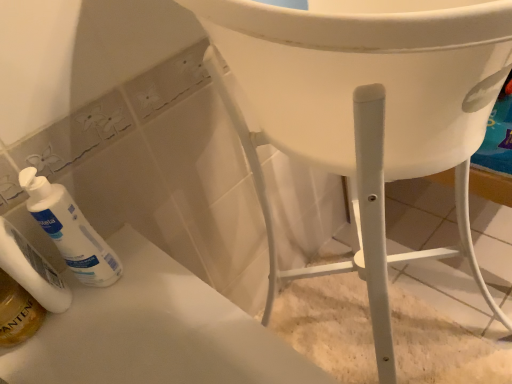
Question: Is translucent golden mouthwash at lower left aimed at white matte lotion at lower left?

Choices:
 (A) yes
 (B) no

Answer: (B)

Question: Does translucent golden mouthwash at lower left appear on the left side of white matte lotion at lower left?

Choices:
 (A) yes
 (B) no

Answer: (A)

Question: From a real-world perspective, is translucent golden mouthwash at lower left beneath white matte lotion at lower left?

Choices:
 (A) yes
 (B) no

Answer: (A)

Question: Is translucent golden mouthwash at lower left taller than white matte lotion at lower left?

Choices:
 (A) yes
 (B) no

Answer: (B)

Question: Is translucent golden mouthwash at lower left closer to the viewer compared to white matte lotion at lower left?

Choices:
 (A) yes
 (B) no

Answer: (B)

Question: Is translucent golden mouthwash at lower left behind white matte lotion at lower left?

Choices:
 (A) yes
 (B) no

Answer: (A)

Question: Would you say white matte lotion at lower left is outside white plastic chair at lower right?

Choices:
 (A) yes
 (B) no

Answer: (A)

Question: Is white matte lotion at lower left turned away from white plastic chair at lower right?

Choices:
 (A) no
 (B) yes

Answer: (A)

Question: Is white plastic chair at lower right completely or partially inside white matte lotion at lower left?

Choices:
 (A) yes
 (B) no

Answer: (B)

Question: Is white matte lotion at lower left bigger than white plastic chair at lower right?

Choices:
 (A) yes
 (B) no

Answer: (B)

Question: From the image's perspective, does white matte lotion at lower left appear lower than white plastic chair at lower right?

Choices:
 (A) yes
 (B) no

Answer: (B)

Question: Does white matte lotion at lower left have a greater height compared to white plastic chair at lower right?

Choices:
 (A) no
 (B) yes

Answer: (B)

Question: From the image's perspective, is translucent golden mouthwash at lower left on top of white plastic chair at lower right?

Choices:
 (A) yes
 (B) no

Answer: (A)